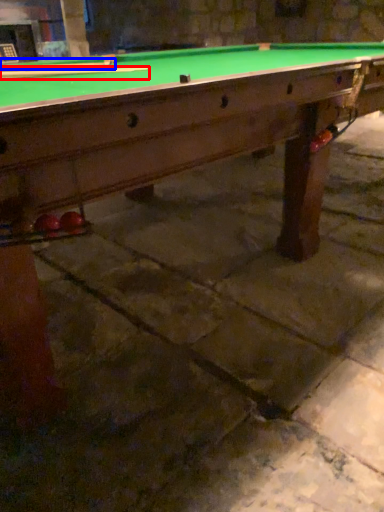
Question: Which of the following is the farthest to the observer, cue (highlighted by a red box) or cue (highlighted by a blue box)?

Choices:
 (A) cue
 (B) cue

Answer: (A)